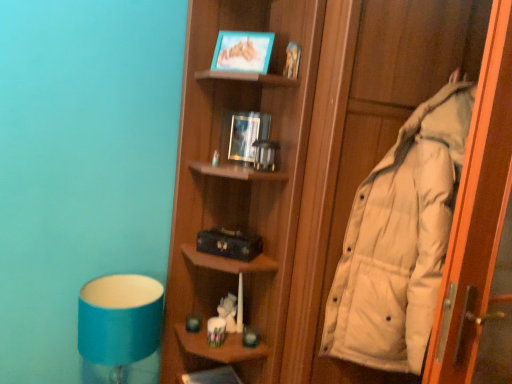
Question: Is blue fabric lampshade at lower left further to camera compared to white down jacket at right?

Choices:
 (A) yes
 (B) no

Answer: (A)

Question: Considering the relative sizes of blue fabric lampshade at lower left and white down jacket at right in the image provided, is blue fabric lampshade at lower left thinner than white down jacket at right?

Choices:
 (A) yes
 (B) no

Answer: (A)

Question: Is blue fabric lampshade at lower left turned away from white down jacket at right?

Choices:
 (A) yes
 (B) no

Answer: (B)

Question: Is blue fabric lampshade at lower left in front of white down jacket at right?

Choices:
 (A) no
 (B) yes

Answer: (A)

Question: Does blue fabric lampshade at lower left have a greater width compared to white down jacket at right?

Choices:
 (A) no
 (B) yes

Answer: (A)

Question: Does blue fabric lampshade at lower left appear on the left side of white down jacket at right?

Choices:
 (A) yes
 (B) no

Answer: (A)

Question: Is wooden shelf at lower center wider than white down jacket at right?

Choices:
 (A) no
 (B) yes

Answer: (A)

Question: Is wooden shelf at lower center looking in the opposite direction of white down jacket at right?

Choices:
 (A) yes
 (B) no

Answer: (B)

Question: Considering the relative sizes of wooden shelf at lower center and white down jacket at right in the image provided, is wooden shelf at lower center thinner than white down jacket at right?

Choices:
 (A) yes
 (B) no

Answer: (A)

Question: From the image's perspective, does wooden shelf at lower center appear lower than white down jacket at right?

Choices:
 (A) yes
 (B) no

Answer: (A)

Question: Is wooden shelf at lower center at the right side of white down jacket at right?

Choices:
 (A) no
 (B) yes

Answer: (A)

Question: Is wooden shelf at lower center completely or partially outside of white down jacket at right?

Choices:
 (A) no
 (B) yes

Answer: (B)

Question: Is white down jacket at right to the left of blue fabric lampshade at lower left from the viewer's perspective?

Choices:
 (A) yes
 (B) no

Answer: (B)